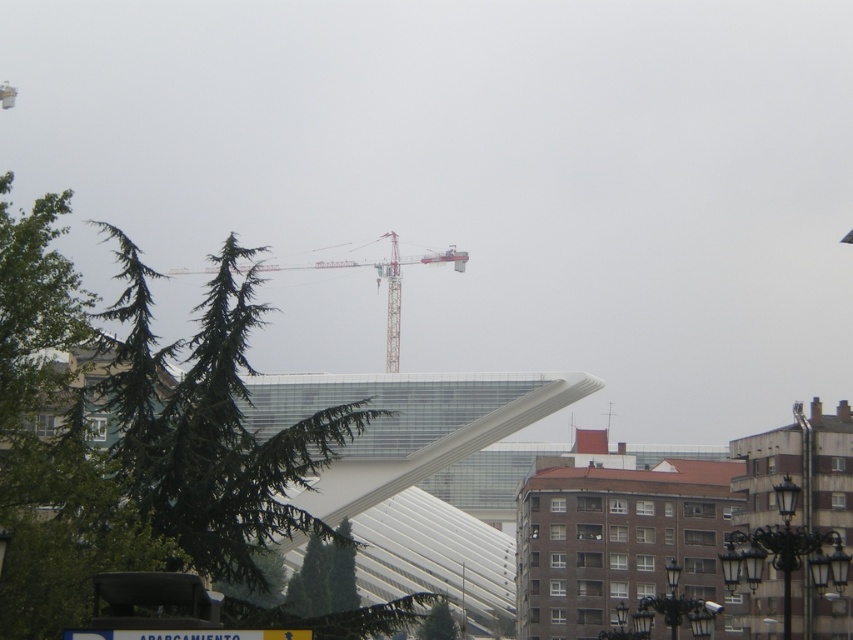
In the scene shown: Who is higher up, metallic gray crane at center or green matte tree at lower center?

Positioned higher is metallic gray crane at center.

Does metallic gray crane at center appear under green matte tree at lower center?

No.

Identify the location of metallic gray crane at center. (380, 280).

Is green needle-like tree at upper left to the left of green matte tree at lower center from the viewer's perspective?

Yes, green needle-like tree at upper left is to the left of green matte tree at lower center.

How much distance is there between green needle-like tree at upper left and green matte tree at lower center?

A distance of 133.59 meters exists between green needle-like tree at upper left and green matte tree at lower center.

This screenshot has width=853, height=640. I want to click on green needle-like tree at upper left, so click(x=132, y=433).

Image resolution: width=853 pixels, height=640 pixels. What are the coordinates of `green needle-like tree at upper left` in the screenshot? It's located at (132, 433).

Does green needle-like tree at upper left have a greater width compared to metallic gray crane at center?

Incorrect, green needle-like tree at upper left's width does not surpass metallic gray crane at center's.

Which is more to the right, green needle-like tree at upper left or metallic gray crane at center?

From the viewer's perspective, green needle-like tree at upper left appears more on the right side.

Identify the location of green needle-like tree at upper left. The image size is (853, 640). (132, 433).

You are a GUI agent. You are given a task and a screenshot of the screen. Output one action in this format:
    pyautogui.click(x=<x>, y=<y>)
    Task: Click on the green needle-like tree at upper left
    This screenshot has width=853, height=640.
    Given the screenshot: What is the action you would take?
    pyautogui.click(x=132, y=433)